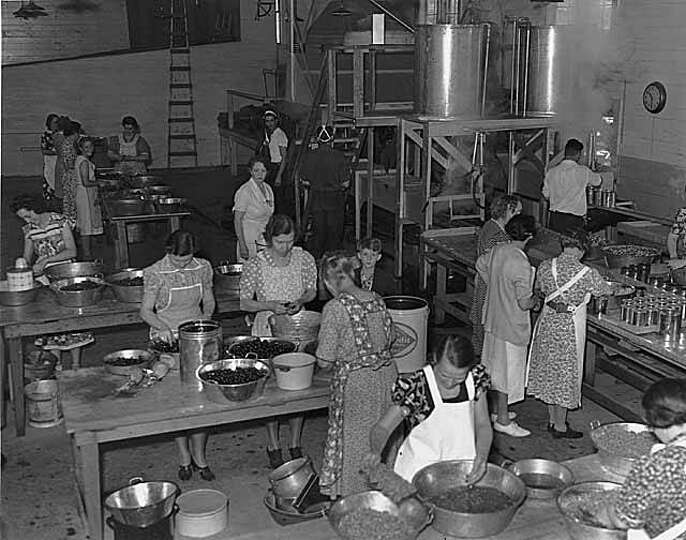
Where is `ladder`? ladder is located at coordinates (182, 87).